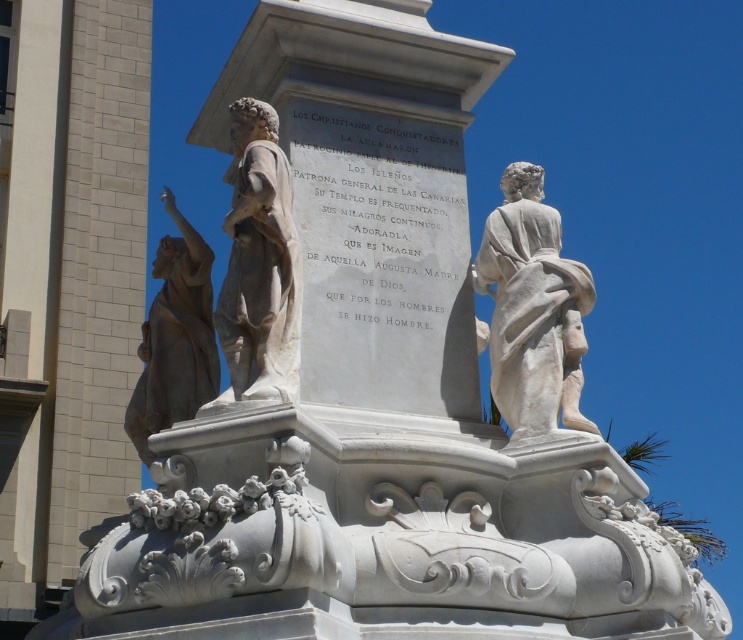
Question: Observing the image, what is the correct spatial positioning of white marble statue at upper right in reference to white marble statue at upper left?

Choices:
 (A) left
 (B) right

Answer: (B)

Question: Which point is closer to the camera taking this photo?

Choices:
 (A) (545, 276)
 (B) (239, 156)
 (C) (158, 296)

Answer: (A)

Question: Can you confirm if white marble statue at upper right is smaller than white marble statue at upper left?

Choices:
 (A) no
 (B) yes

Answer: (B)

Question: Which point is closer to the camera?

Choices:
 (A) (198, 305)
 (B) (272, 257)
 (C) (532, 224)

Answer: (B)

Question: Which point is closer to the camera?

Choices:
 (A) white marble statue at upper left
 (B) white marble statue at upper right
 (C) bronze statue at left

Answer: (A)

Question: Is white marble statue at upper right further to camera compared to bronze statue at left?

Choices:
 (A) no
 (B) yes

Answer: (B)